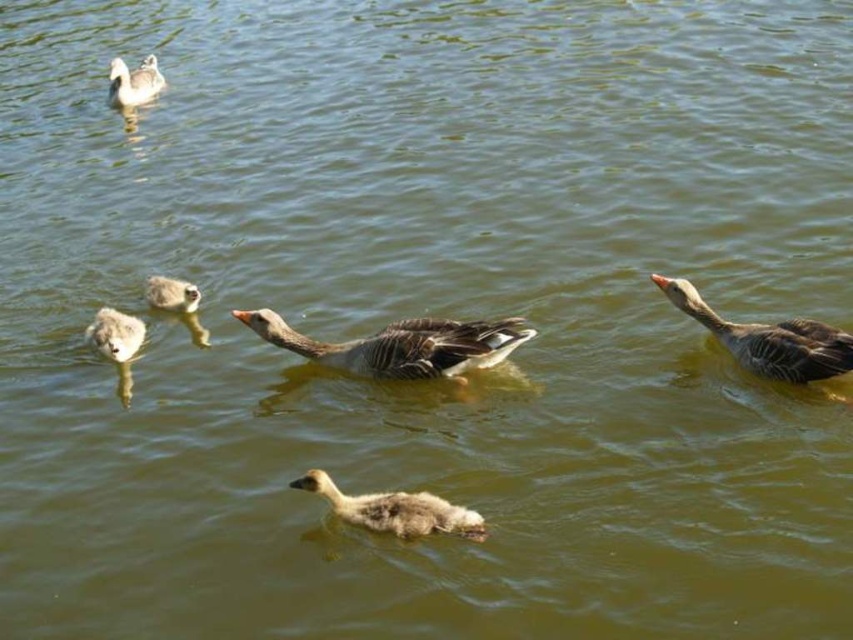
Question: Which point is closer to the camera?

Choices:
 (A) (132, 323)
 (B) (137, 104)
 (C) (407, 330)
 (D) (178, 305)

Answer: (C)

Question: Is fluffy gray duckling at lower left thinner than gray downy duckling at upper left?

Choices:
 (A) no
 (B) yes

Answer: (B)

Question: Can you confirm if fluffy gray duckling at lower left is positioned to the left of gray downy duckling at upper left?

Choices:
 (A) yes
 (B) no

Answer: (A)

Question: Which object appears farthest from the camera in this image?

Choices:
 (A) gray matte duck at right
 (B) speckled downy duckling at center
 (C) gray matte duck at center

Answer: (C)

Question: Does fluffy gray duckling at lower left appear over gray matte duckling at upper left?

Choices:
 (A) no
 (B) yes

Answer: (A)

Question: Which point appears closest to the camera in this image?

Choices:
 (A) (368, 516)
 (B) (692, 285)
 (C) (431, 344)

Answer: (A)